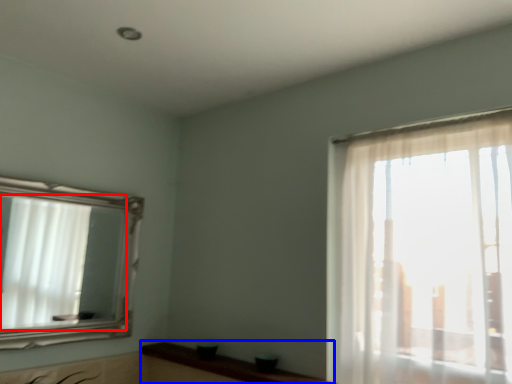
Question: Which object appears farthest to the camera in this image, mirror (highlighted by a red box) or counter top (highlighted by a blue box)?

Choices:
 (A) mirror
 (B) counter top

Answer: (A)